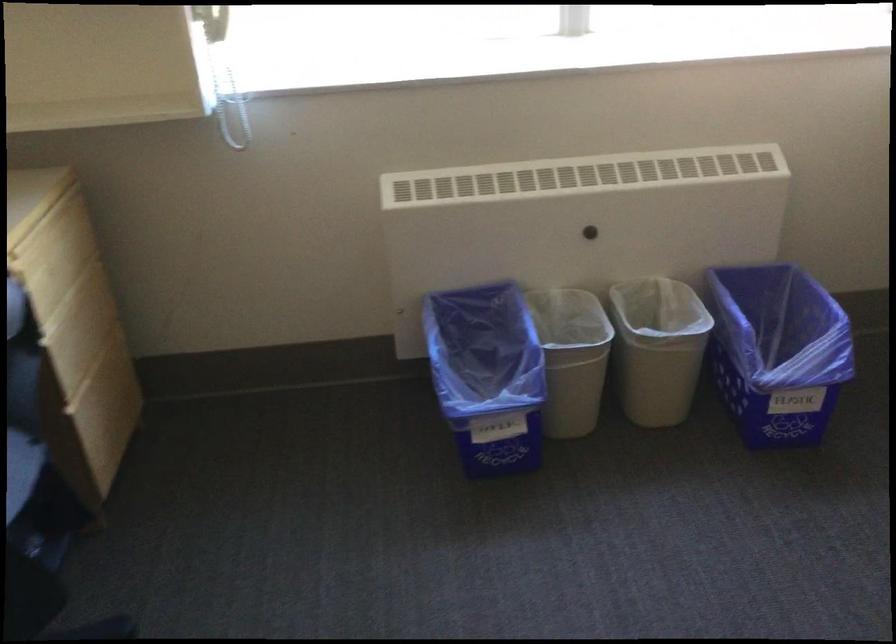
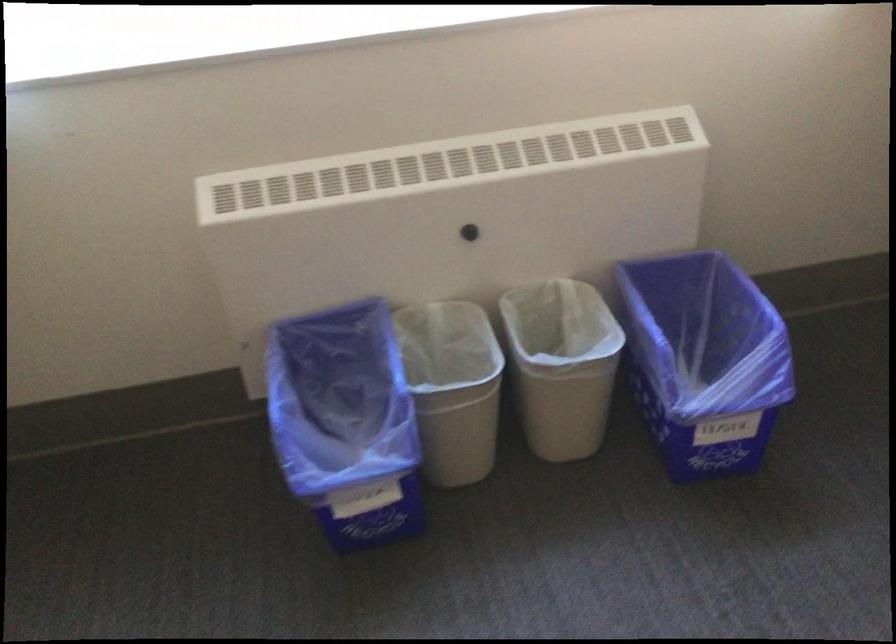
The point at (590, 230) is marked in the first image. Where is the corresponding point in the second image?

(469, 232)